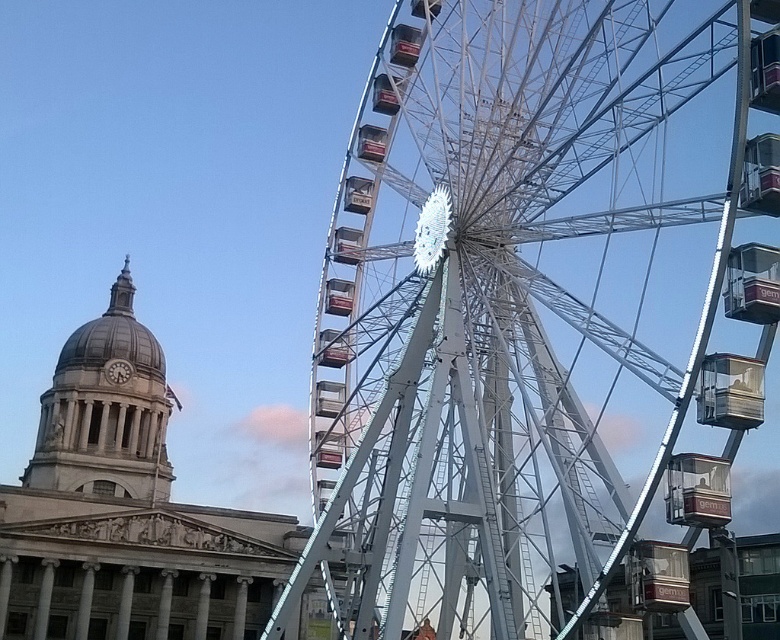
Question: Is white metallic ferris wheel at center in front of matte gray dome at upper left?

Choices:
 (A) no
 (B) yes

Answer: (B)

Question: Which point is farther to the camera?

Choices:
 (A) (133, 426)
 (B) (768, 342)

Answer: (A)

Question: Observing the image, what is the correct spatial positioning of white metallic ferris wheel at center in reference to matte gray dome at upper left?

Choices:
 (A) below
 (B) above

Answer: (B)

Question: Can you confirm if white metallic ferris wheel at center is smaller than matte gray dome at upper left?

Choices:
 (A) yes
 (B) no

Answer: (B)

Question: Which object appears farthest from the camera in this image?

Choices:
 (A) matte gray dome at upper left
 (B) white metallic ferris wheel at center

Answer: (A)